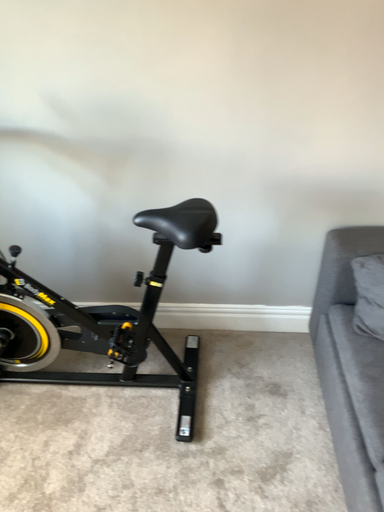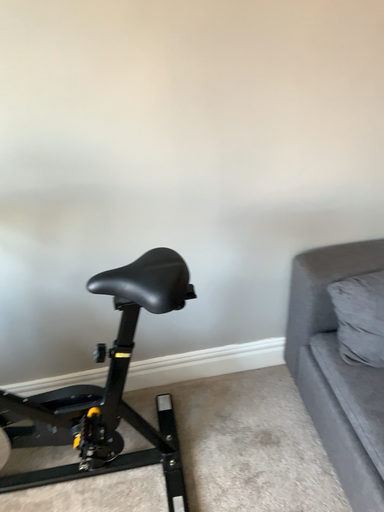
Question: How did the camera likely rotate when shooting the video?

Choices:
 (A) rotated left
 (B) rotated right

Answer: (B)